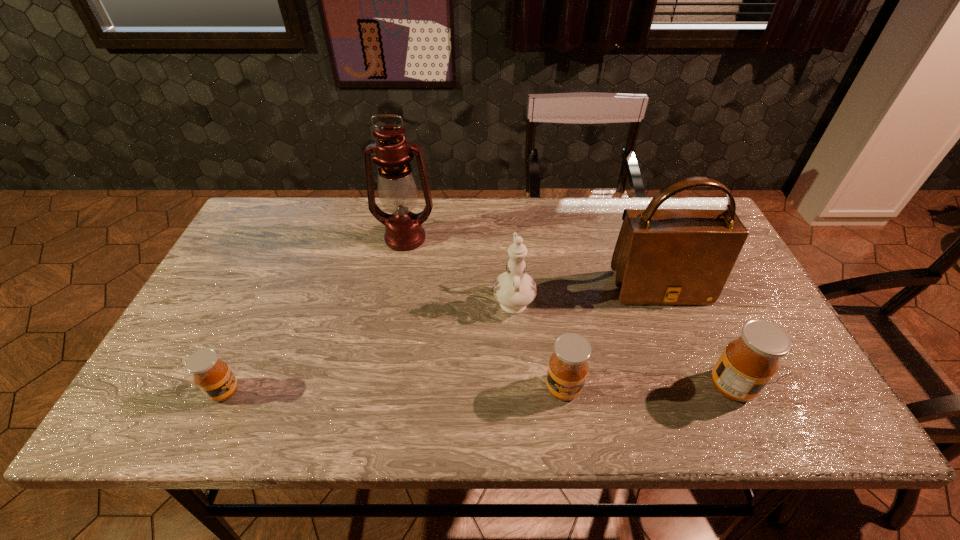
Where is `the shortest honey`? Image resolution: width=960 pixels, height=540 pixels. the shortest honey is located at coordinates (214, 378).

The width and height of the screenshot is (960, 540). Identify the location of the shortest object. (214, 378).

The image size is (960, 540). In order to click on the second shortest honey in this screenshot , I will do `click(568, 367)`.

This screenshot has height=540, width=960. In order to click on the second shortest object in this screenshot , I will do `click(568, 367)`.

Where is `the tallest honey`? the tallest honey is located at coordinates (748, 363).

Where is `the rightmost honey`? the rightmost honey is located at coordinates (748, 363).

You are a GUI agent. You are given a task and a screenshot of the screen. Output one action in this format:
    pyautogui.click(x=<x>, y=<y>)
    Task: Click on the oil lamp
    
    Given the screenshot: What is the action you would take?
    pyautogui.click(x=398, y=191)

The height and width of the screenshot is (540, 960). In order to click on the fifth object from right to left in this screenshot , I will do `click(398, 191)`.

Where is `the fifth shortest object`? The width and height of the screenshot is (960, 540). the fifth shortest object is located at coordinates (662, 256).

This screenshot has width=960, height=540. What are the coordinates of `chinaware` in the screenshot? It's located at (514, 290).